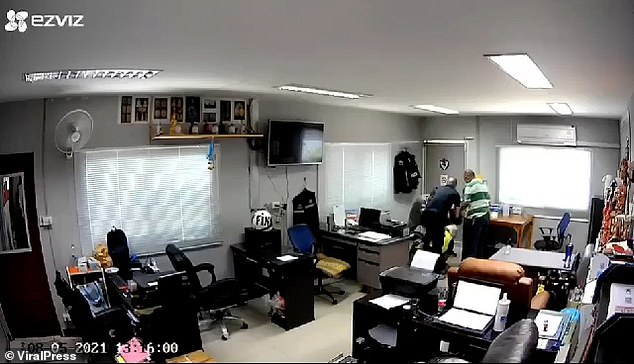
The height and width of the screenshot is (364, 634). In order to click on tv in this screenshot , I will do `click(298, 147)`.